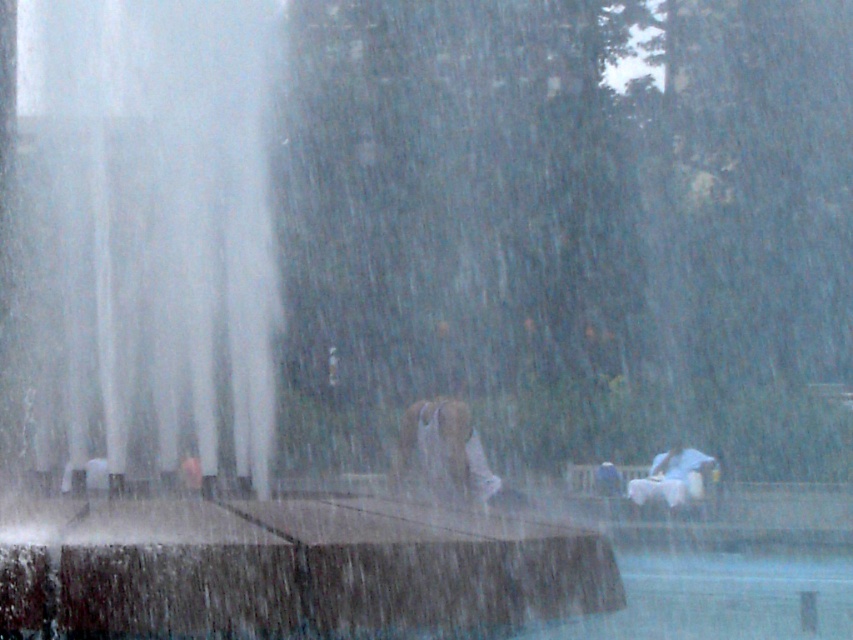
Who is positioned more to the left, transparent glass fountain at center or white matte horse at lower right?

From the viewer's perspective, transparent glass fountain at center appears more on the left side.

Does transparent glass fountain at center have a lesser height compared to white matte horse at lower right?

In fact, transparent glass fountain at center may be taller than white matte horse at lower right.

Does point (96, 253) come closer to viewer compared to point (666, 490)?

Yes, point (96, 253) is closer to viewer.

Where is `transparent glass fountain at center`? The height and width of the screenshot is (640, 853). transparent glass fountain at center is located at coordinates (200, 365).